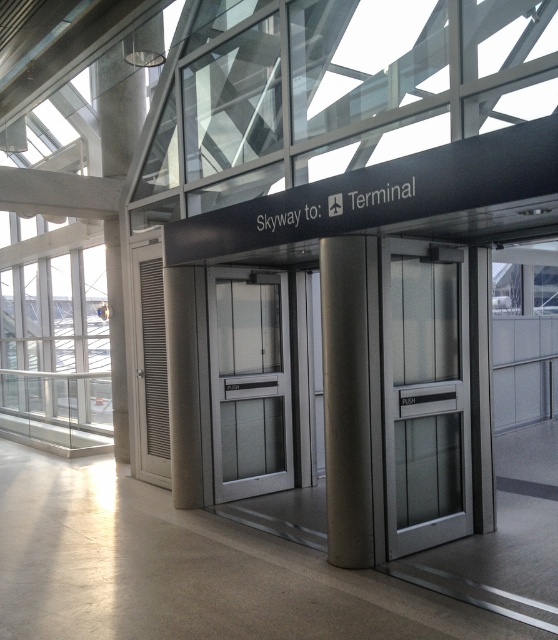
Locate an element on the screen. The height and width of the screenshot is (640, 558). satin silver elevator at center is located at coordinates (425, 394).

Can you confirm if satin silver elevator at center is thinner than frosted glass door at center?

Yes.

Who is more forward, (x=455, y=260) or (x=223, y=364)?

Point (x=455, y=260) is in front.

Where is `satin silver elevator at center`? The image size is (558, 640). satin silver elevator at center is located at coordinates (425, 394).

Does satin silver elevator at center have a smaller size compared to satin silver column at center?

Incorrect, satin silver elevator at center is not smaller in size than satin silver column at center.

Between point (403, 250) and point (359, 522), which one is positioned behind?

The point (403, 250) is behind.

Identify the location of satin silver elevator at center. This screenshot has width=558, height=640. (425, 394).

Measure the distance between frosted glass door at center and satin silver column at center.

They are 6.82 feet apart.

Is point (211, 316) in front of point (358, 259)?

No.

Who is more distant from viewer, [291,458] or [324,433]?

The point [291,458] is behind.

Where is `frosted glass door at center`? This screenshot has height=640, width=558. frosted glass door at center is located at coordinates (249, 381).